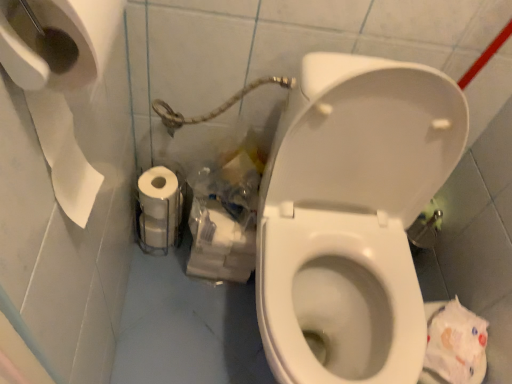
Describe the element at coordinates (159, 207) in the screenshot. The height and width of the screenshot is (384, 512). I see `white matte toilet paper at lower left` at that location.

The width and height of the screenshot is (512, 384). What do you see at coordinates (226, 215) in the screenshot? I see `translucent plastic bag at lower center` at bounding box center [226, 215].

Find the location of `translucent plastic bag at lower center`. translucent plastic bag at lower center is located at coordinates (226, 215).

Image resolution: width=512 pixels, height=384 pixels. What do you see at coordinates (352, 215) in the screenshot?
I see `white glossy toilet at center` at bounding box center [352, 215].

Image resolution: width=512 pixels, height=384 pixels. In order to click on white matte toilet paper at lower left in this screenshot , I will do `click(159, 207)`.

Based on the photo, from a real-world perspective, which object rests below the other?

white matte toilet paper at lower left is physically lower.

Considering the sizes of objects white glossy toilet at center and white matte toilet paper at lower left in the image provided, who is thinner, white glossy toilet at center or white matte toilet paper at lower left?

With smaller width is white matte toilet paper at lower left.

Is white glossy toilet at center at the left side of white matte toilet paper at lower left?

No, white glossy toilet at center is not to the left of white matte toilet paper at lower left.

Is white glossy toilet at center bigger or smaller than white matte toilet paper at lower left?

Clearly, white glossy toilet at center is larger in size than white matte toilet paper at lower left.

Locate an element on the screen. This screenshot has height=384, width=512. toilet paper behind the translucent plastic bag at lower center is located at coordinates (159, 207).

Is translucent plastic bag at lower center inside white matte toilet paper at lower left?

No, white matte toilet paper at lower left does not contain translucent plastic bag at lower center.

Is white matte toilet paper at lower left oriented away from translucent plastic bag at lower center?

white matte toilet paper at lower left does not have its back to translucent plastic bag at lower center.

Considering their positions, is white matte toilet paper at lower left located in front of or behind translucent plastic bag at lower center?

Clearly, white matte toilet paper at lower left is behind translucent plastic bag at lower center.

From a real-world perspective, is white matte toilet paper at lower left over white glossy toilet at center?

No, from a real-world perspective, white matte toilet paper at lower left is not on top of white glossy toilet at center.

Choose the correct answer: Is white matte toilet paper at lower left inside white glossy toilet at center or outside it?

white matte toilet paper at lower left cannot be found inside white glossy toilet at center.

Does white matte toilet paper at lower left have a lesser width compared to white glossy toilet at center?

Yes.

The height and width of the screenshot is (384, 512). I want to click on garbage lying on the left of white glossy toilet at center, so click(x=226, y=215).

Looking at this image, between white glossy toilet at center and translucent plastic bag at lower center, which one appears on the right side from the viewer's perspective?

Positioned to the right is white glossy toilet at center.

Is white glossy toilet at center oriented towards translucent plastic bag at lower center?

No, white glossy toilet at center is not facing towards translucent plastic bag at lower center.

Considering the sizes of objects translucent plastic bag at lower center and white matte toilet paper at lower left in the image provided, who is bigger, translucent plastic bag at lower center or white matte toilet paper at lower left?

With larger size is translucent plastic bag at lower center.

Does translucent plastic bag at lower center have a greater height compared to white matte toilet paper at lower left?

Yes.

From a real-world perspective, is translucent plastic bag at lower center physically below white matte toilet paper at lower left?

No, from a real-world perspective, translucent plastic bag at lower center is not beneath white matte toilet paper at lower left.

Could you tell me if translucent plastic bag at lower center is facing white matte toilet paper at lower left?

No, translucent plastic bag at lower center is not turned towards white matte toilet paper at lower left.

Who is smaller, translucent plastic bag at lower center or white glossy toilet at center?

translucent plastic bag at lower center is smaller.

From a real-world perspective, which object stands above the other?

From a 3D spatial view, white glossy toilet at center is above.

How distant is translucent plastic bag at lower center from white glossy toilet at center?

A distance of 11.23 inches exists between translucent plastic bag at lower center and white glossy toilet at center.

Does translucent plastic bag at lower center have a greater width compared to white glossy toilet at center?

In fact, translucent plastic bag at lower center might be narrower than white glossy toilet at center.

Locate an element on the screen. toilet paper on the left of white glossy toilet at center is located at coordinates [x=159, y=207].

Where is `toilet paper above the translucent plastic bag at lower center (from the image's perspective)`? toilet paper above the translucent plastic bag at lower center (from the image's perspective) is located at coordinates (159, 207).

Estimate the real-world distances between objects in this image. Which object is further from white matte toilet paper at lower left, white glossy toilet at center or translucent plastic bag at lower center?

white glossy toilet at center is further to white matte toilet paper at lower left.

Looking at the image, which one is located closer to white matte toilet paper at lower left, translucent plastic bag at lower center or white glossy toilet at center?

translucent plastic bag at lower center is closer to white matte toilet paper at lower left.

When comparing their distances from translucent plastic bag at lower center, does white matte toilet paper at lower left or white glossy toilet at center seem further?

white glossy toilet at center.

Considering their positions, is white glossy toilet at center positioned further to translucent plastic bag at lower center than white matte toilet paper at lower left?

white glossy toilet at center is positioned further to the anchor translucent plastic bag at lower center.

Which object lies further to the anchor point white glossy toilet at center, translucent plastic bag at lower center or white matte toilet paper at lower left?

Among the two, white matte toilet paper at lower left is located further to white glossy toilet at center.

Considering their positions, is white matte toilet paper at lower left positioned further to white glossy toilet at center than translucent plastic bag at lower center?

The object further to white glossy toilet at center is white matte toilet paper at lower left.

Identify the location of garbage between white glossy toilet at center and white matte toilet paper at lower left along the z-axis. (226, 215).